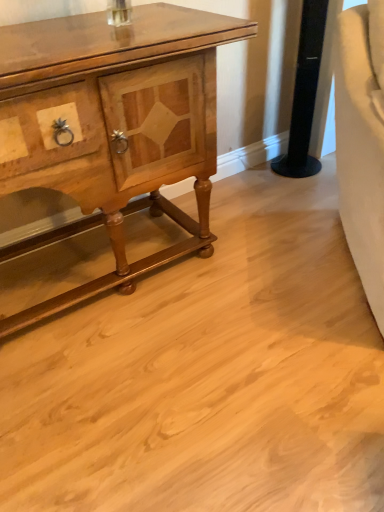
Question: Based on their sizes in the image, would you say black glossy speaker at upper right is bigger or smaller than wooden polished cabinet at left?

Choices:
 (A) big
 (B) small

Answer: (B)

Question: In terms of width, does black glossy speaker at upper right look wider or thinner when compared to wooden polished cabinet at left?

Choices:
 (A) thin
 (B) wide

Answer: (A)

Question: From a real-world perspective, is black glossy speaker at upper right positioned above or below wooden polished cabinet at left?

Choices:
 (A) above
 (B) below

Answer: (B)

Question: Relative to black glossy speaker at upper right, is wooden polished cabinet at left in front or behind?

Choices:
 (A) behind
 (B) front

Answer: (B)

Question: From a real-world perspective, is wooden polished cabinet at left physically located above or below black glossy speaker at upper right?

Choices:
 (A) below
 (B) above

Answer: (B)

Question: In terms of height, does wooden polished cabinet at left look taller or shorter compared to black glossy speaker at upper right?

Choices:
 (A) tall
 (B) short

Answer: (A)

Question: Would you say wooden polished cabinet at left is to the left or to the right of black glossy speaker at upper right in the picture?

Choices:
 (A) right
 (B) left

Answer: (B)